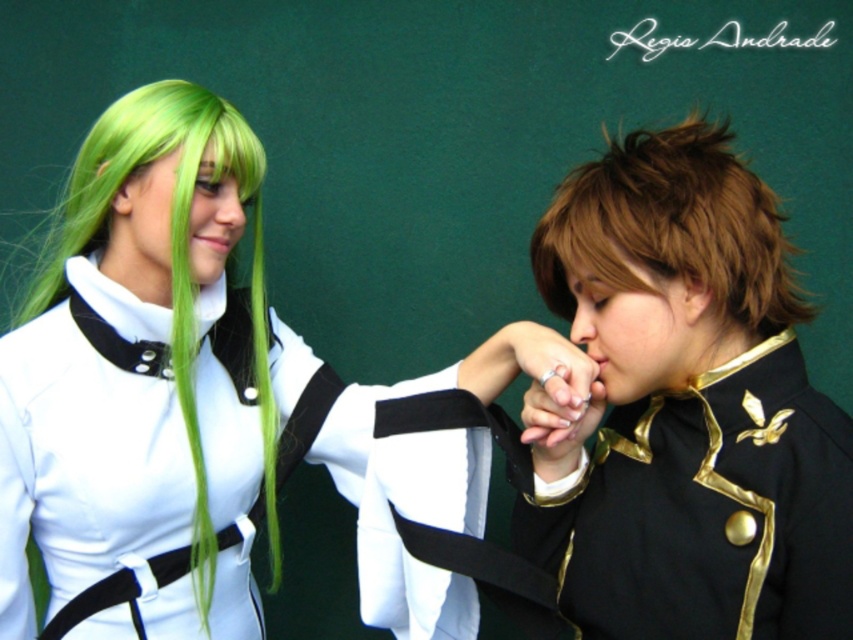
Between point (561, 448) and point (688, 189), which one is positioned in front?

Positioned in front is point (688, 189).

Measure the distance between point (x=602, y=545) and camera.

They are 97.98 centimeters apart.

Find the location of a particular element. The width and height of the screenshot is (853, 640). shiny gold uniform at center is located at coordinates (688, 406).

Between matte white uniform at center and green silky wig at left, which one has more height?

Standing taller between the two is matte white uniform at center.

Between matte white uniform at center and green silky wig at left, which one appears on the right side from the viewer's perspective?

matte white uniform at center

Which is behind, point (65, 397) or point (169, 120)?

Point (169, 120)

You are a GUI agent. You are given a task and a screenshot of the screen. Output one action in this format:
    pyautogui.click(x=<x>, y=<y>)
    Task: Click on the matte white uniform at center
    
    Given the screenshot: What is the action you would take?
    (x=177, y=387)

Does brown shiny hair at center appear on the right side of green silky wig at left?

Correct, you'll find brown shiny hair at center to the right of green silky wig at left.

Between brown shiny hair at center and green silky wig at left, which one is positioned lower?

green silky wig at left is below.

Who is more distant from viewer, (634, 282) or (160, 92)?

The point (160, 92) is more distant.

Identify the location of brown shiny hair at center. (671, 227).